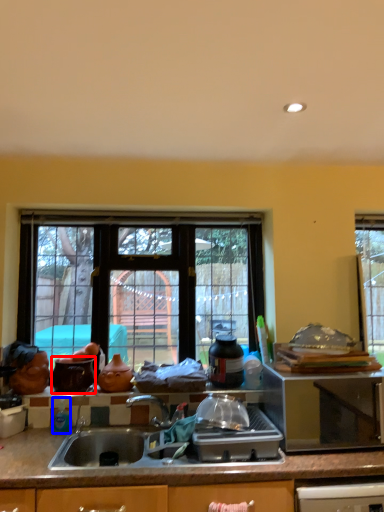
Question: Which object appears closest to the camera in this image, appliance (highlighted by a red box) or bottle (highlighted by a blue box)?

Choices:
 (A) appliance
 (B) bottle

Answer: (B)